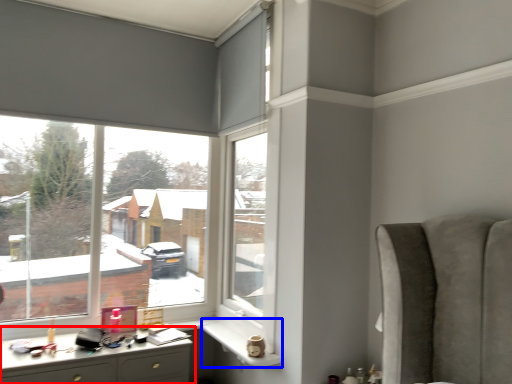
Question: Which object is further to the camera taking this photo, desk (highlighted by a red box) or window sill (highlighted by a blue box)?

Choices:
 (A) desk
 (B) window sill

Answer: (B)